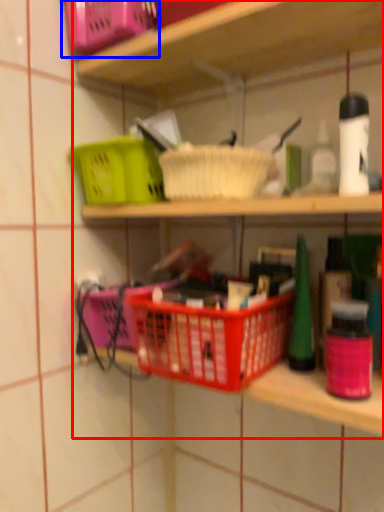
Question: Which object appears closest to the camera in this image, shelf (highlighted by a red box) or basket (highlighted by a blue box)?

Choices:
 (A) shelf
 (B) basket

Answer: (A)